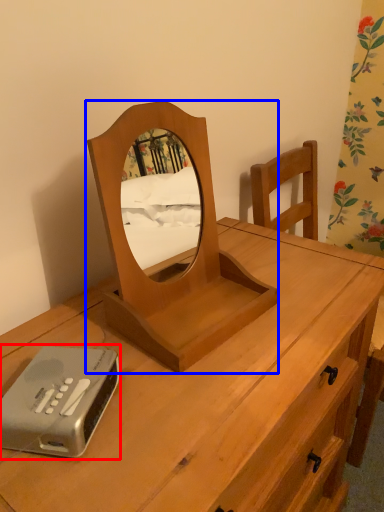
Question: Among these objects, which one is nearest to the camera, gadget (highlighted by a red box) or mirror (highlighted by a blue box)?

Choices:
 (A) gadget
 (B) mirror

Answer: (B)